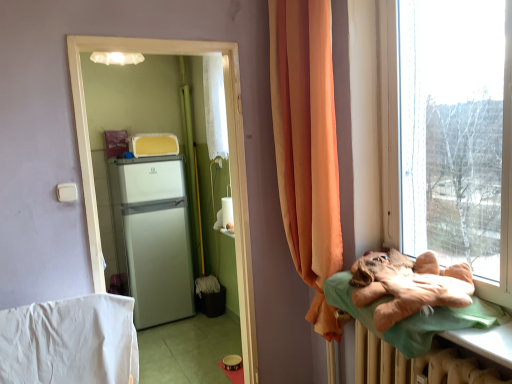
Question: Considering the relative sizes of brown plush bear at right and white matte refrigerator at left in the image provided, is brown plush bear at right thinner than white matte refrigerator at left?

Choices:
 (A) no
 (B) yes

Answer: (A)

Question: Can you confirm if brown plush bear at right is bigger than white matte refrigerator at left?

Choices:
 (A) yes
 (B) no

Answer: (B)

Question: Is brown plush bear at right closer to the viewer compared to white matte refrigerator at left?

Choices:
 (A) no
 (B) yes

Answer: (B)

Question: Is brown plush bear at right to the left of white matte refrigerator at left from the viewer's perspective?

Choices:
 (A) yes
 (B) no

Answer: (B)

Question: Is brown plush bear at right turned away from white matte refrigerator at left?

Choices:
 (A) no
 (B) yes

Answer: (A)

Question: Does brown plush bear at right have a lesser height compared to white matte refrigerator at left?

Choices:
 (A) no
 (B) yes

Answer: (B)

Question: From a real-world perspective, is white matte refrigerator at left on white glossy refrigerator at center?

Choices:
 (A) yes
 (B) no

Answer: (B)

Question: From the image's perspective, is white matte refrigerator at left on white glossy refrigerator at center?

Choices:
 (A) no
 (B) yes

Answer: (A)

Question: From the image's perspective, is white matte refrigerator at left under white glossy refrigerator at center?

Choices:
 (A) yes
 (B) no

Answer: (A)

Question: Is white matte refrigerator at left at the left side of white glossy refrigerator at center?

Choices:
 (A) yes
 (B) no

Answer: (A)

Question: Is white glossy refrigerator at center at the back of white matte refrigerator at left?

Choices:
 (A) no
 (B) yes

Answer: (A)

Question: Is white matte refrigerator at left in front of white glossy refrigerator at center?

Choices:
 (A) yes
 (B) no

Answer: (B)

Question: Are white matte refrigerator at left and white cotton blanket at lower left far apart?

Choices:
 (A) yes
 (B) no

Answer: (A)